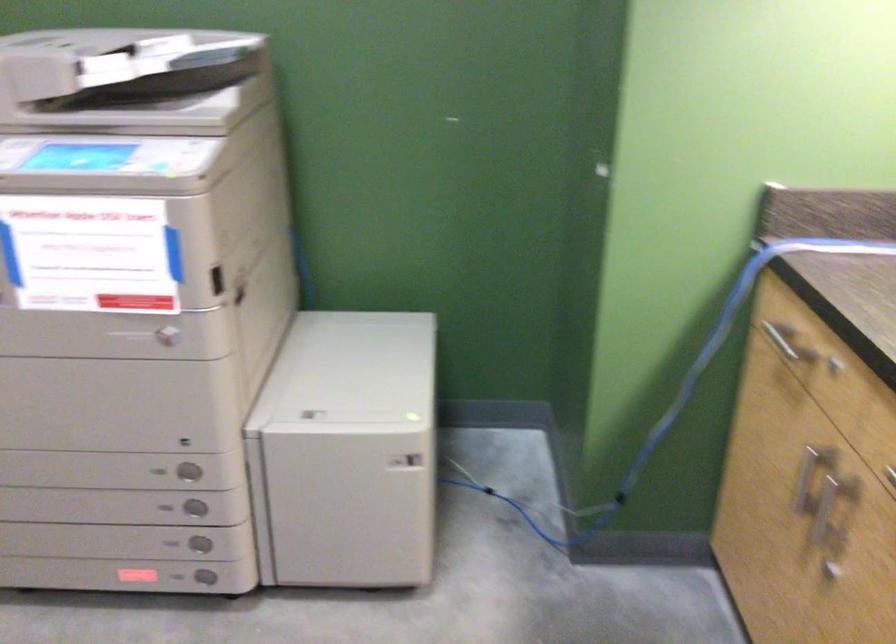
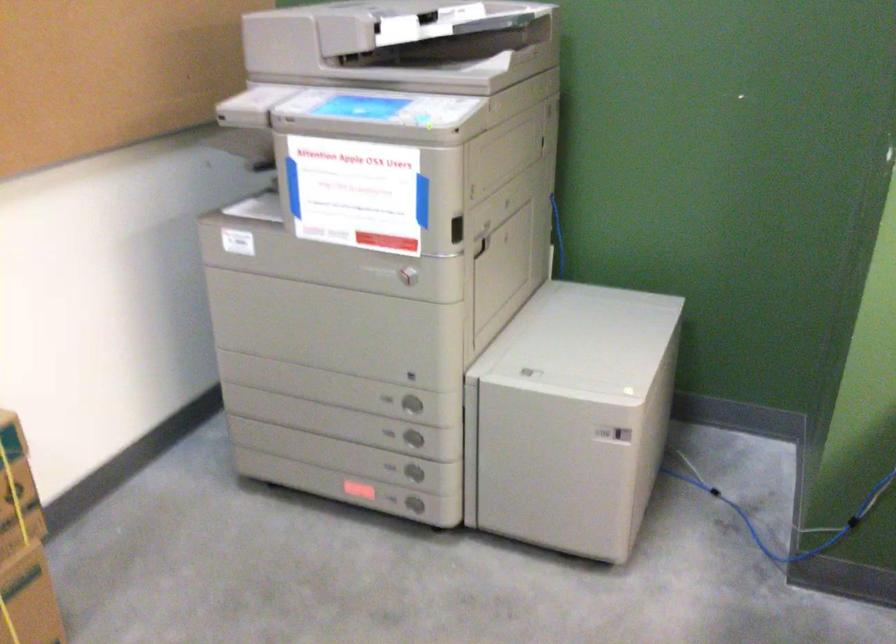
Where in the second image is the point corresponding to (143,71) from the first image?

(424, 28)